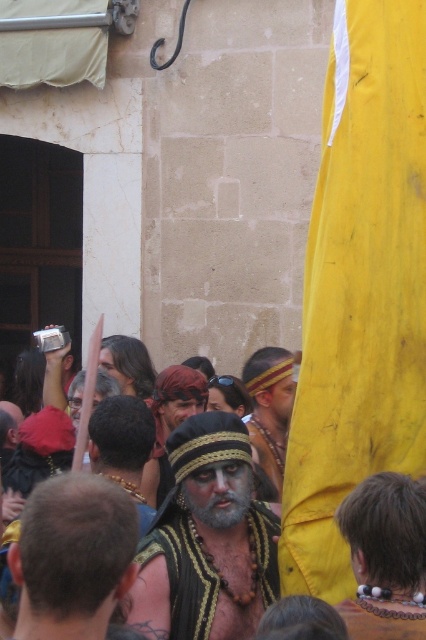
Question: In this image, where is black textured fabric at center located relative to matte gold headband at center?

Choices:
 (A) right
 (B) left

Answer: (B)

Question: Is bearded man with striped hat at center closer to the viewer compared to graywoollybeard at center?

Choices:
 (A) yes
 (B) no

Answer: (A)

Question: Is bearded man with striped hat at center further to camera compared to matte gold headband at center?

Choices:
 (A) yes
 (B) no

Answer: (B)

Question: Which is farther from the bearded man with striped hat at center?

Choices:
 (A) graywoollybeard at center
 (B) beige textured fabric at center
 (C) matte gold headband at center
 (D) black textured fabric at center

Answer: (C)

Question: Among these points, which one is farthest from the camera?

Choices:
 (A) (317, 497)
 (B) (167, 440)
 (C) (371, 538)
 (D) (147, 440)

Answer: (D)

Question: Which point is farther to the camera?

Choices:
 (A) (268, 436)
 (B) (126, 532)

Answer: (A)